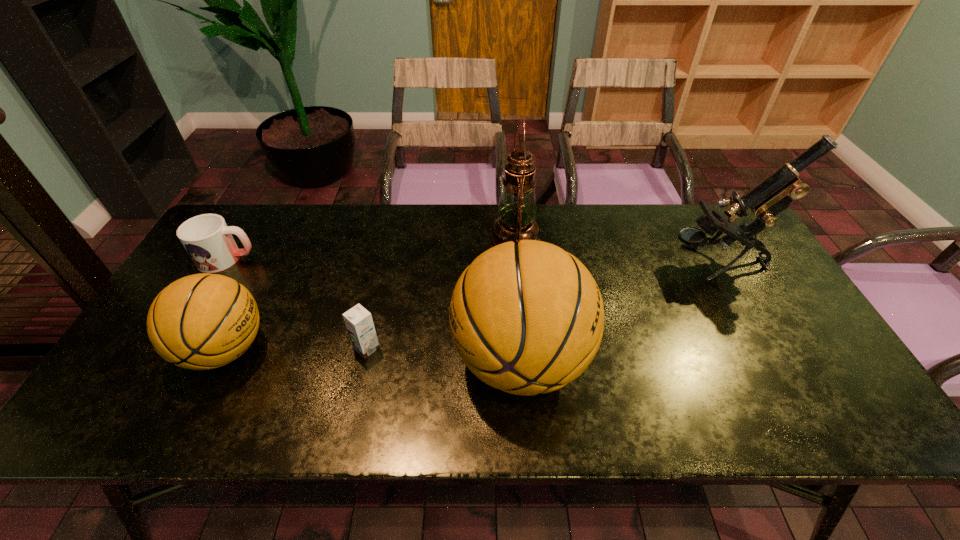
Please point out where to position a new basketball on the right to maintain spacing. Please provide its 2D coordinates. Your answer should be formatted as a tuple, i.e. [(x, y)], where the tuple contains the x and y coordinates of a point satisfying the conditions above.

[(829, 372)]